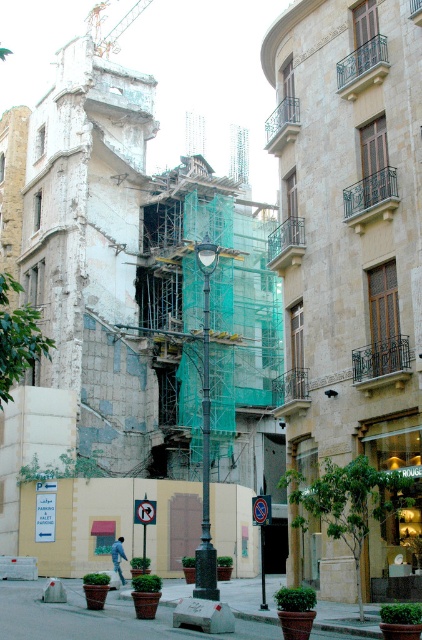
You are a pedestrian standing on the sidewalk and see the green painted metal pole at center and the denim jacket at lower left. Which object is closer to the right side of the street?

The green painted metal pole at center is closer to the right side of the street because it is to the right of the denim jacket at lower left.

You are standing on the sidewalk and want to reach the denim jacket at lower left. There is a green painted metal pole at center in your path. Will you need to go around the pole to reach the jacket?

The green painted metal pole at center is closer to the viewer than the denim jacket at lower left, so you will need to go around the pole to reach the jacket.

You are standing at the point marked by the coordinates point (205, 476) in the urban street scene. What object are you standing next to?

The point (205, 476) corresponds to the green painted metal pole at center, so you are standing next to the green painted metal pole at center.